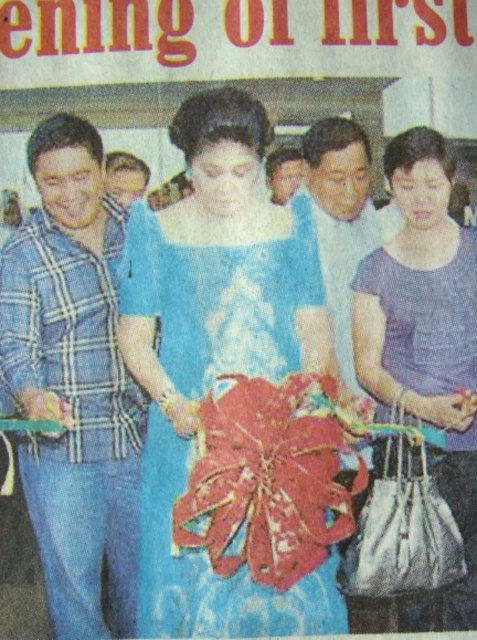
You are a photographer at the event and want to capture a photo of both the blue satin dress at center and the blue plaid shirt at left. Which one should you focus on first to ensure both are in focus?

You should focus on the blue satin dress at center first because it is closer to the viewer than the blue plaid shirt at left, so adjusting focus from near to far will help both be in focus.

What are the coordinates of the blue satin dress at center?

The blue satin dress at center is located at coordinates point (218, 358).